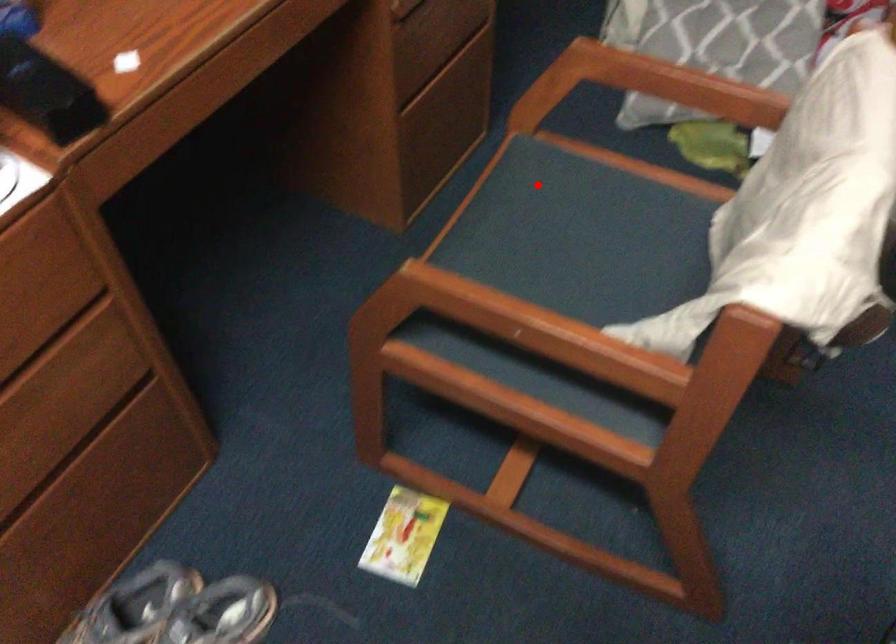
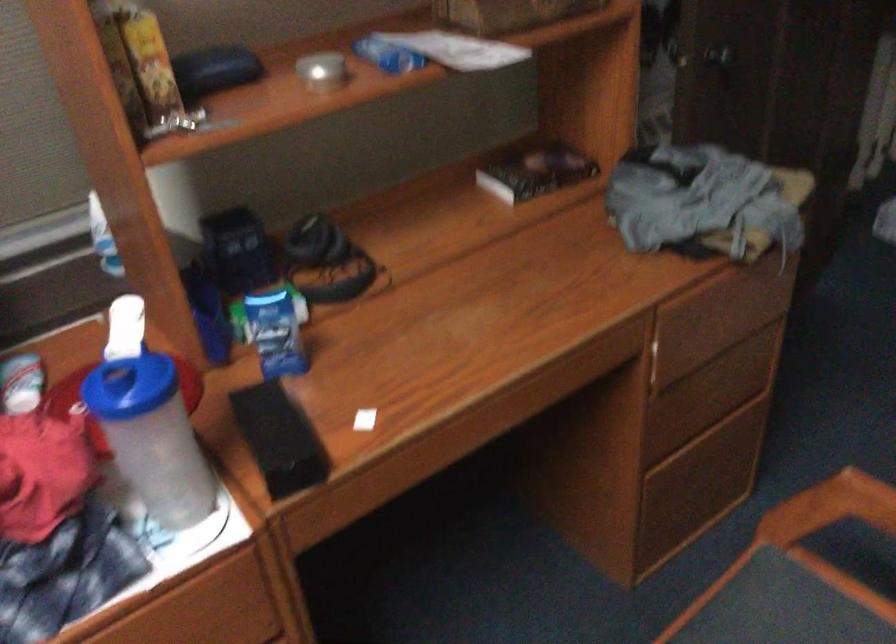
Question: I am providing you with two images of the same scene from different viewpoints. Given a red point in image1, look at the same physical point in image2. Is it:

Choices:
 (A) Closer to the viewpoint
 (B) Farther from the viewpoint

Answer: (A)